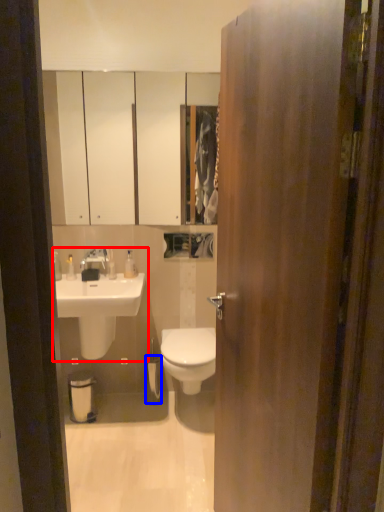
Question: Which point is further to the camera, sink (highlighted by a red box) or toilet paper (highlighted by a blue box)?

Choices:
 (A) sink
 (B) toilet paper

Answer: (B)